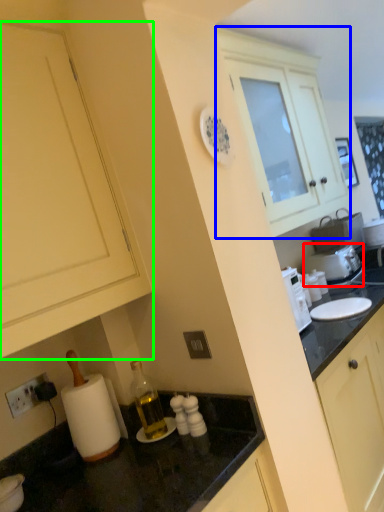
Question: Which is farther away from appliance (highlighted by a red box)? cabinetry (highlighted by a blue box) or cabinetry (highlighted by a green box)?

Choices:
 (A) cabinetry
 (B) cabinetry

Answer: (B)